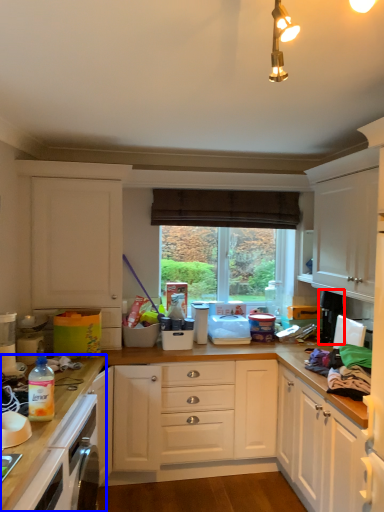
Question: Which point is further to the camera, appliance (highlighted by a red box) or countertop (highlighted by a blue box)?

Choices:
 (A) appliance
 (B) countertop

Answer: (A)